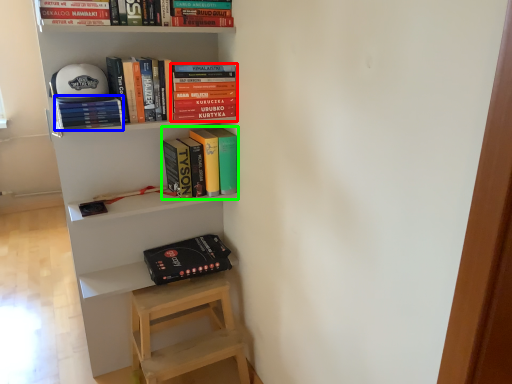
Question: Considering the real-world distances, which object is closest to book (highlighted by a red box)? book (highlighted by a blue box) or book (highlighted by a green box).

Choices:
 (A) book
 (B) book

Answer: (B)